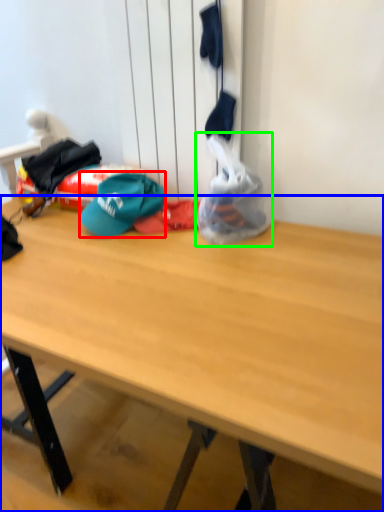
Question: Which is farther away from hat (highlighted by a red box)? desk (highlighted by a blue box) or plastic bag (highlighted by a green box)?

Choices:
 (A) desk
 (B) plastic bag

Answer: (A)